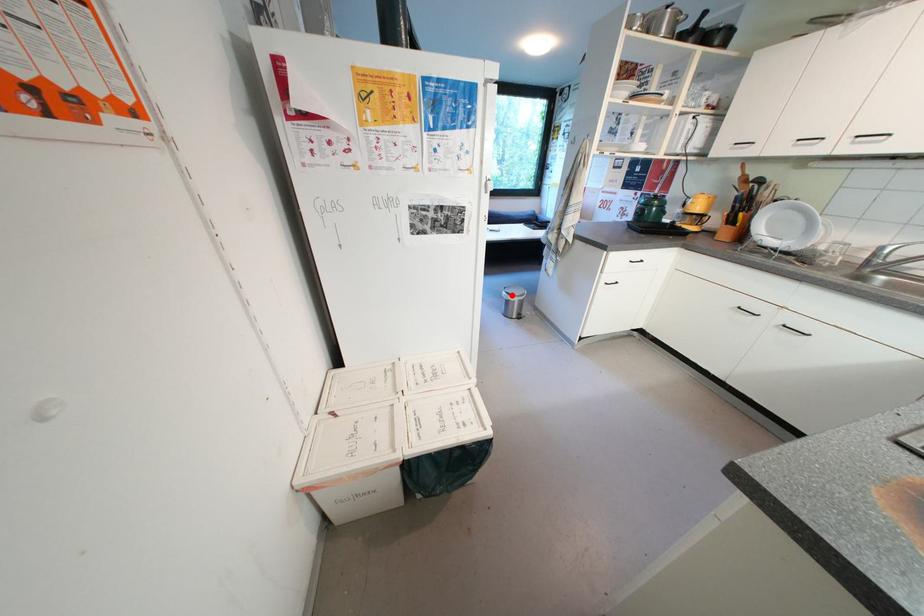
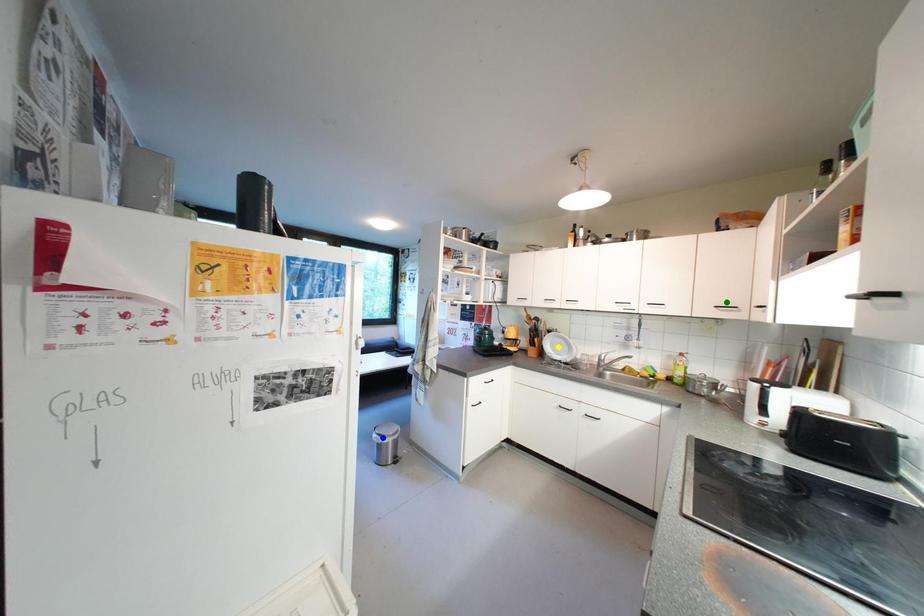
Question: I am providing you with two images of the same scene from different viewpoints. A red point is marked on the first image. You are given multiple points on the second image. Which spot in image 2 lines up with the point in image 1?

Choices:
 (A) blue point
 (B) yellow point
 (C) green point

Answer: (A)